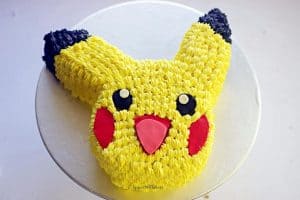
Where is `plate`? The height and width of the screenshot is (200, 300). plate is located at coordinates (66, 124), (240, 121), (137, 30).